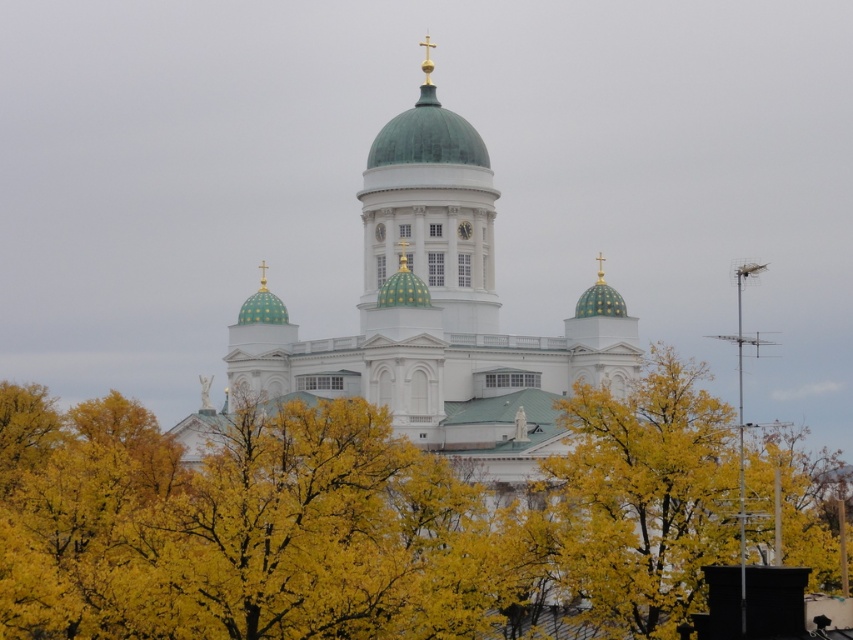
Which is more to the left, yellow leafy tree at center or green matte dome at center?

yellow leafy tree at center is more to the left.

Is point (750, 502) farther from viewer compared to point (432, 150)?

That is False.

This screenshot has width=853, height=640. What do you see at coordinates (358, 522) in the screenshot? I see `yellow leafy tree at center` at bounding box center [358, 522].

Locate an element on the screen. This screenshot has height=640, width=853. yellow leafy tree at center is located at coordinates (358, 522).

Consider the image. Is yellow leafy tree at center to the right of green dome at center from the viewer's perspective?

No, yellow leafy tree at center is not to the right of green dome at center.

Who is positioned more to the right, yellow leafy tree at center or green dome at center?

From the viewer's perspective, green dome at center appears more on the right side.

Is point (106, 456) more distant than point (457, 132)?

That is False.

This screenshot has height=640, width=853. Find the location of `yellow leafy tree at center`. yellow leafy tree at center is located at coordinates (358, 522).

Looking at this image, is green dome at center taller than green matte dome at center?

Indeed, green dome at center has a greater height compared to green matte dome at center.

Is point (427, 236) in front of point (428, 134)?

Yes, it is in front of point (428, 134).

This screenshot has width=853, height=640. Find the location of `green dome at center`. green dome at center is located at coordinates (431, 211).